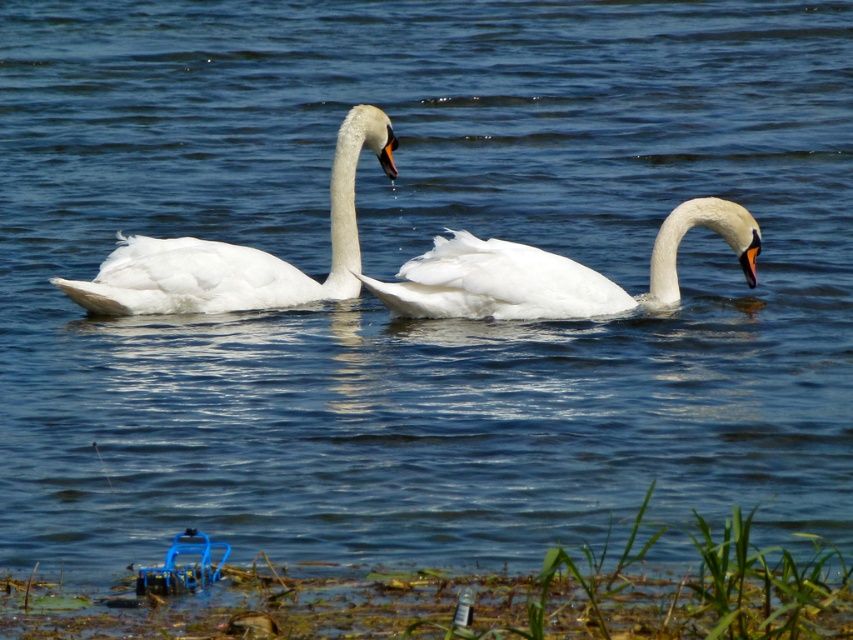
Who is shorter, white glossy swan at center or white feathered swan at center?

Standing shorter between the two is white feathered swan at center.

Can you confirm if white glossy swan at center is positioned to the right of white feathered swan at center?

In fact, white glossy swan at center is to the left of white feathered swan at center.

Where is `white glossy swan at center`? white glossy swan at center is located at coordinates (238, 252).

The image size is (853, 640). Identify the location of white glossy swan at center. (238, 252).